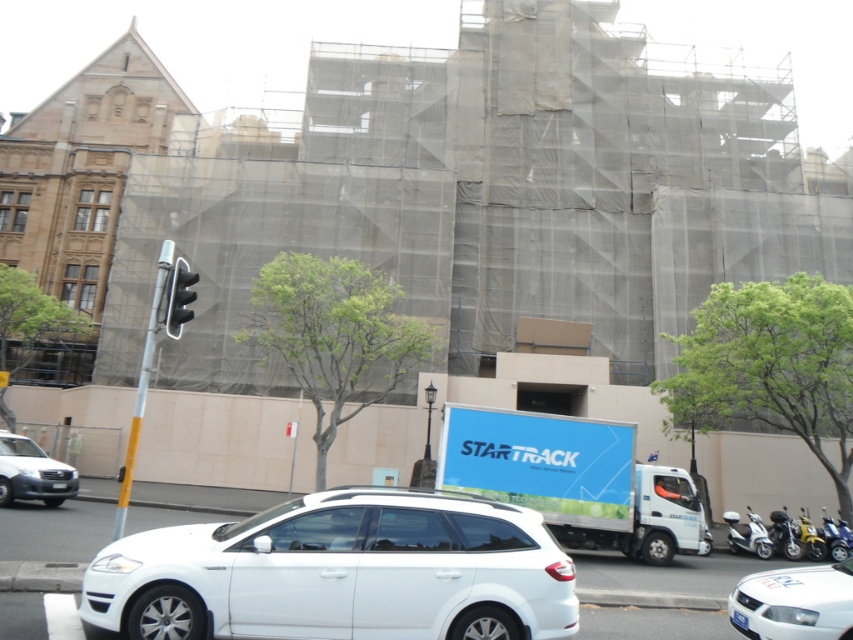
Is silver metallic sedan at lower left smaller than metallic silver scooter at lower right?

No, silver metallic sedan at lower left is not smaller than metallic silver scooter at lower right.

What do you see at coordinates (32, 472) in the screenshot? The width and height of the screenshot is (853, 640). I see `silver metallic sedan at lower left` at bounding box center [32, 472].

This screenshot has width=853, height=640. What are the coordinates of `silver metallic sedan at lower left` in the screenshot? It's located at (32, 472).

Who is higher up, silver metallic sedan at lower left or metallic silver motorcycle at lower right?

silver metallic sedan at lower left is higher up.

The width and height of the screenshot is (853, 640). Describe the element at coordinates (32, 472) in the screenshot. I see `silver metallic sedan at lower left` at that location.

The width and height of the screenshot is (853, 640). What do you see at coordinates (32, 472) in the screenshot? I see `silver metallic sedan at lower left` at bounding box center [32, 472].

At what (x,y) coordinates should I click in order to perform the action: click on silver metallic sedan at lower left. Please return your answer as a coordinate pair (x, y). Looking at the image, I should click on (32, 472).

Is white glossy sedan at lower right bigger than metallic silver scooter at lower right?

No.

Is point (775, 582) less distant than point (728, 541)?

Yes.

Find the location of a particular element. The width and height of the screenshot is (853, 640). white glossy sedan at lower right is located at coordinates (793, 602).